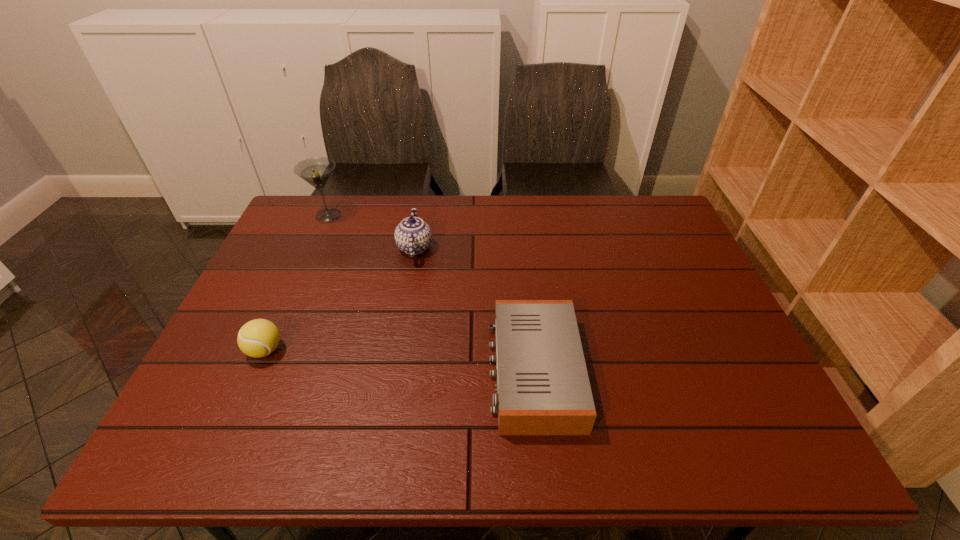
In the image, there is a desktop. Find the location of `vacant space at the near edge`. vacant space at the near edge is located at coordinates (541, 458).

Image resolution: width=960 pixels, height=540 pixels. I want to click on free space at the left edge of the desktop, so click(302, 292).

This screenshot has width=960, height=540. Find the location of `vacant space at the far left corner of the desktop`. vacant space at the far left corner of the desktop is located at coordinates (292, 221).

In the image, there is a desktop. Where is `vacant space at the far right corner`? vacant space at the far right corner is located at coordinates (630, 205).

At what (x,y) coordinates should I click in order to perform the action: click on vacant space at the near right corner. Please return your answer as a coordinate pair (x, y). Image resolution: width=960 pixels, height=540 pixels. Looking at the image, I should click on (774, 433).

This screenshot has height=540, width=960. Find the location of `free space between the second farthest object and the third tallest object`. free space between the second farthest object and the third tallest object is located at coordinates (340, 299).

Identify the location of free point between the tennis ball and the third shortest object. The height and width of the screenshot is (540, 960). (340, 299).

Where is `vacant region between the third nearest object and the martini`? This screenshot has width=960, height=540. vacant region between the third nearest object and the martini is located at coordinates (372, 232).

The width and height of the screenshot is (960, 540). Find the location of `free point between the rightmost object and the farthest object`. free point between the rightmost object and the farthest object is located at coordinates (431, 293).

Where is `vacant space that's between the chinaware and the rightmost object`? vacant space that's between the chinaware and the rightmost object is located at coordinates (474, 309).